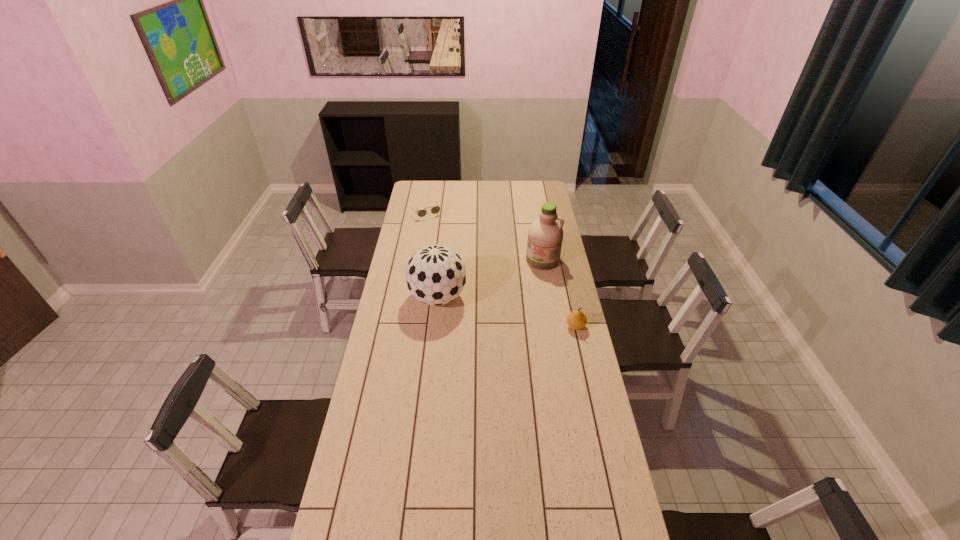
The image size is (960, 540). What are the coordinates of `the third shortest object` in the screenshot? It's located at (435, 275).

At what (x,y) coordinates should I click in order to perform the action: click on the second nearest object. Please return your answer as a coordinate pair (x, y). The height and width of the screenshot is (540, 960). Looking at the image, I should click on (435, 275).

I want to click on the nearest object, so click(x=576, y=320).

Where is `pear`? pear is located at coordinates (576, 320).

At what (x,y) coordinates should I click in order to perform the action: click on the tallest object. Please return your answer as a coordinate pair (x, y). Looking at the image, I should click on (545, 235).

Find the location of `cleansing agent`. cleansing agent is located at coordinates (545, 235).

In order to click on the shortest object in this screenshot , I will do `click(434, 210)`.

Locate an element on the screen. the farthest object is located at coordinates (434, 210).

Image resolution: width=960 pixels, height=540 pixels. I want to click on vacant space located 0.400m on the back of the third shortest object, so click(x=444, y=232).

The image size is (960, 540). I want to click on vacant space located 0.110m on the back of the pear, so click(x=570, y=302).